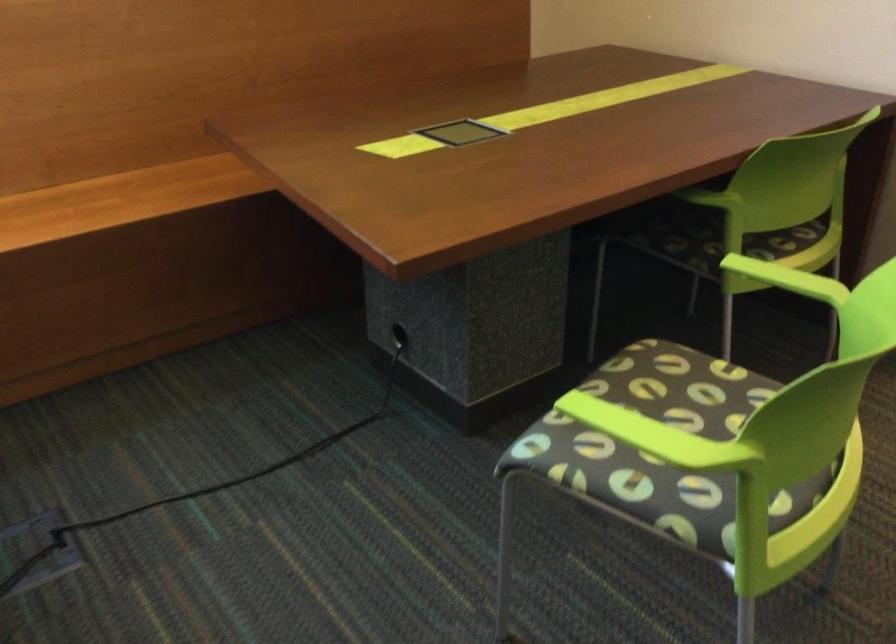
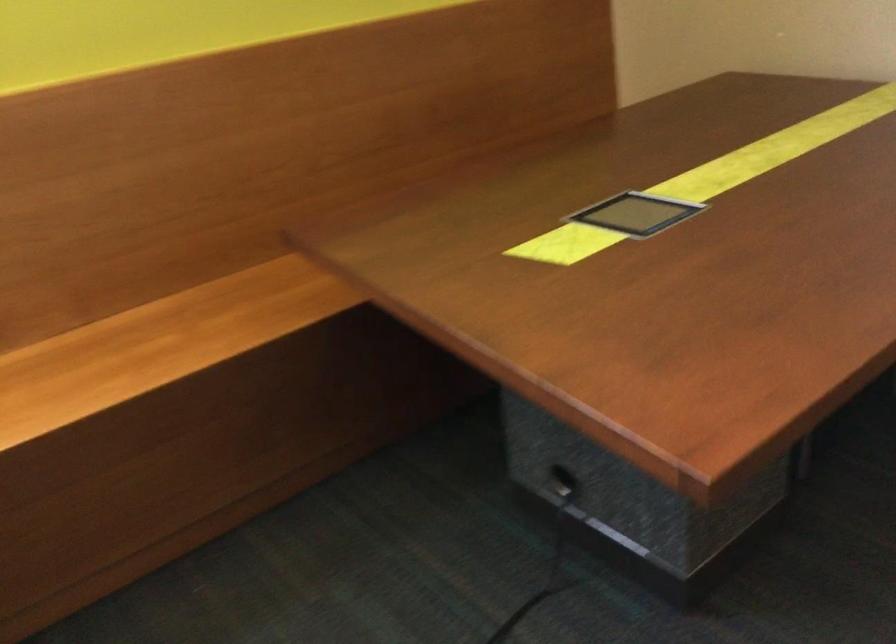
The images are taken continuously from a first-person perspective. In which direction are you moving?

The cameraman walked toward left, forward.